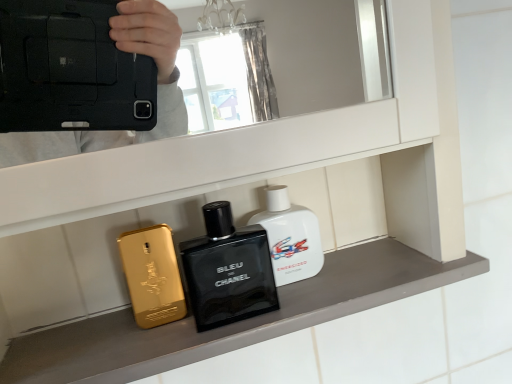
Question: Can you confirm if black glass perfume at center is shorter than metallic gold phone at center?

Choices:
 (A) no
 (B) yes

Answer: (A)

Question: Is black glass perfume at center looking in the opposite direction of metallic gold phone at center?

Choices:
 (A) no
 (B) yes

Answer: (A)

Question: Does black glass perfume at center appear on the right side of metallic gold phone at center?

Choices:
 (A) yes
 (B) no

Answer: (B)

Question: Is black glass perfume at center located outside metallic gold phone at center?

Choices:
 (A) no
 (B) yes

Answer: (B)

Question: Does black glass perfume at center have a lesser width compared to metallic gold phone at center?

Choices:
 (A) yes
 (B) no

Answer: (A)

Question: From the image's perspective, is black glass perfume at center above metallic gold phone at center?

Choices:
 (A) yes
 (B) no

Answer: (A)

Question: Is black glass perfume at center positioned behind white glossy bottle at center, the first perfume positioned from the right?

Choices:
 (A) yes
 (B) no

Answer: (B)

Question: From the image's perspective, is black glass perfume at center located beneath white glossy bottle at center, the first perfume positioned from the right?

Choices:
 (A) yes
 (B) no

Answer: (A)

Question: Could you tell me if black glass perfume at center is turned towards white glossy bottle at center, the 2th perfume in the left-to-right sequence?

Choices:
 (A) yes
 (B) no

Answer: (B)

Question: Can you confirm if black glass perfume at center is thinner than white glossy bottle at center, the 2th perfume in the left-to-right sequence?

Choices:
 (A) no
 (B) yes

Answer: (A)

Question: Could white glossy bottle at center, the first perfume positioned from the right, be considered to be inside black glass perfume at center?

Choices:
 (A) yes
 (B) no

Answer: (B)

Question: Is black glass perfume at center smaller than white glossy bottle at center, the first perfume positioned from the right?

Choices:
 (A) no
 (B) yes

Answer: (A)

Question: Can you confirm if white glossy bottle at center, the 2th perfume in the left-to-right sequence, is shorter than black glass perfume at center?

Choices:
 (A) yes
 (B) no

Answer: (A)